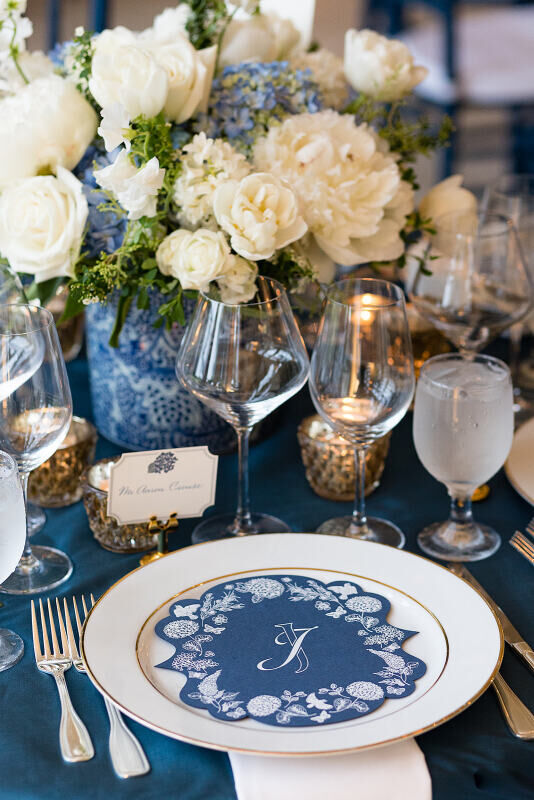
At what (x,y) coordinates should I click in order to perform the action: click on plate. Please return your answer as a coordinate pair (x, y). This screenshot has height=800, width=534. Looking at the image, I should click on (464, 630).